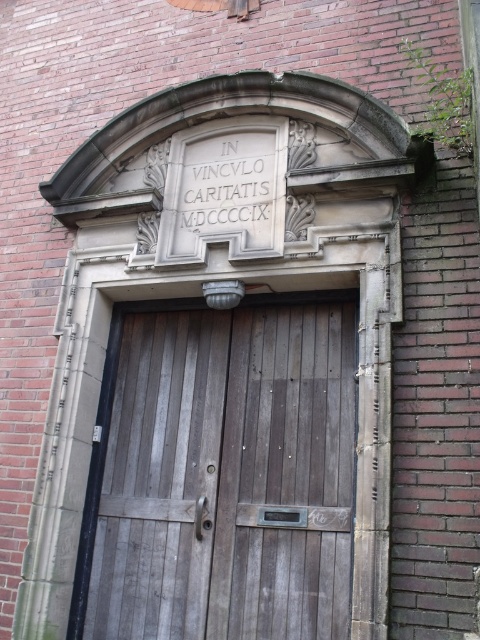
Who is taller, wooden door at center or white stone inscription at center?

wooden door at center

Which is in front, point (333, 339) or point (235, 218)?

Point (333, 339) is more forward.

Identify the location of wooden door at center. The width and height of the screenshot is (480, 640). (223, 474).